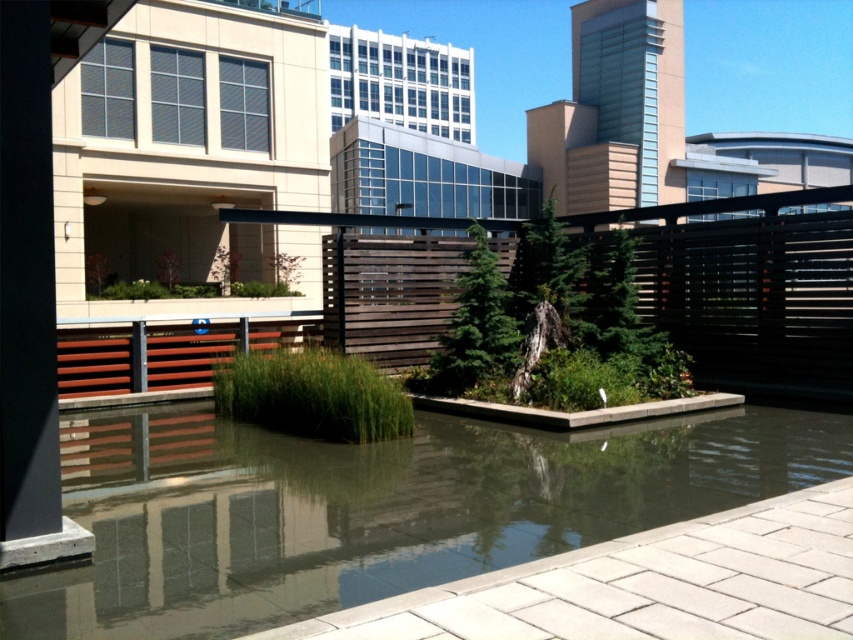
Question: Which point is closer to the camera taking this photo?

Choices:
 (A) (386, 273)
 (B) (357, 541)

Answer: (B)

Question: Where is clear glass water at center located in relation to dark brown wooden fence at center in the image?

Choices:
 (A) left
 (B) right

Answer: (B)

Question: Does clear glass water at center come behind dark brown wooden fence at center?

Choices:
 (A) no
 (B) yes

Answer: (A)

Question: In this image, where is clear glass water at center located relative to dark brown wooden fence at center?

Choices:
 (A) left
 (B) right

Answer: (B)